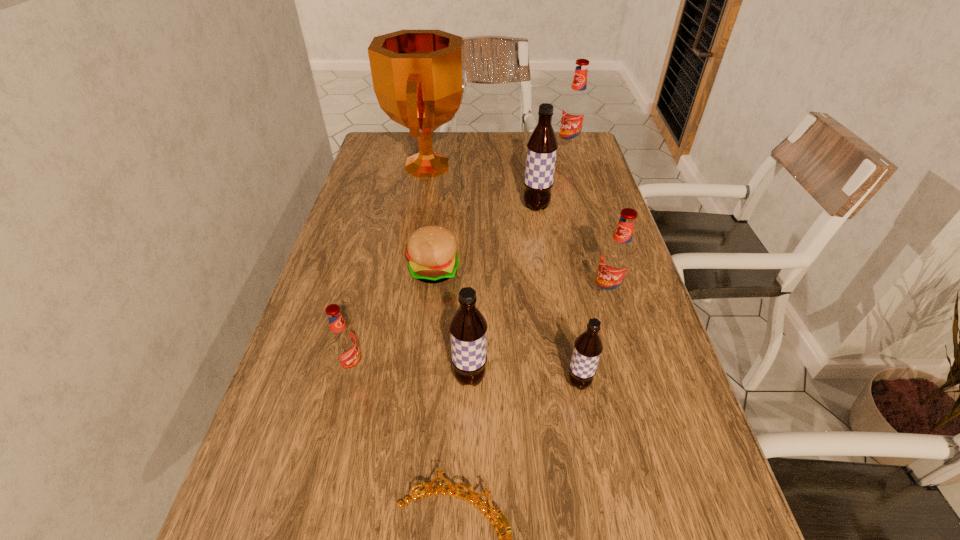
You are a GUI agent. You are given a task and a screenshot of the screen. Output one action in this format:
    pyautogui.click(x=<x>, y=<y>)
    Task: Click on the leftmost root beer
    The width and height of the screenshot is (960, 540).
    Given the screenshot: What is the action you would take?
    pyautogui.click(x=343, y=342)

You are a GUI agent. You are given a task and a screenshot of the screen. Output one action in this format:
    pyautogui.click(x=<x>, y=<y>)
    Task: Click on the leftmost red root beer
    The width and height of the screenshot is (960, 540).
    Given the screenshot: What is the action you would take?
    pyautogui.click(x=343, y=342)

Image resolution: width=960 pixels, height=540 pixels. Find the location of `the smallest brown root beer`. the smallest brown root beer is located at coordinates (588, 346).

You are a GUI agent. You are given a task and a screenshot of the screen. Output one action in this format:
    pyautogui.click(x=<x>, y=<y>)
    Task: Click on the hamburger
    This screenshot has height=540, width=960.
    Given the screenshot: What is the action you would take?
    pyautogui.click(x=431, y=250)

At what (x,y) coordinates should I click in order to perform the action: click on blank space located 0.140m on the side of the tallest object with the star emblem. Please return your answer as a coordinate pair (x, y). This screenshot has height=540, width=960. Looking at the image, I should click on (511, 166).

Identify the location of vacant space positioned on the back of the farthest red root beer. Image resolution: width=960 pixels, height=540 pixels. coord(564,137).

Where is `free space located 0.320m on the left of the fifth nearest root beer`? free space located 0.320m on the left of the fifth nearest root beer is located at coordinates (412, 207).

This screenshot has width=960, height=540. In order to click on vacant space situated 0.130m on the front of the second biggest red root beer in this screenshot , I will do `click(622, 353)`.

You are a GUI agent. You are given a task and a screenshot of the screen. Output one action in this format:
    pyautogui.click(x=<x>, y=<y>)
    Task: Click on the vacant space located 0.220m on the front of the leftmost brown root beer
    The image size is (960, 540).
    Given the screenshot: What is the action you would take?
    pyautogui.click(x=467, y=518)

Image resolution: width=960 pixels, height=540 pixels. I want to click on vacant area located 0.170m on the right of the leftmost root beer, so click(449, 369).